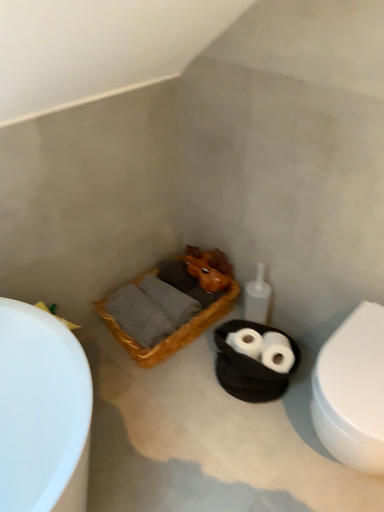
Question: Is white matte toilet paper at center wider than white glossy toilet at right?

Choices:
 (A) yes
 (B) no

Answer: (B)

Question: Is white matte toilet paper at center looking in the opposite direction of white glossy toilet at right?

Choices:
 (A) no
 (B) yes

Answer: (A)

Question: Is white matte toilet paper at center completely or partially outside of white glossy toilet at right?

Choices:
 (A) no
 (B) yes

Answer: (B)

Question: Is the depth of white matte toilet paper at center greater than that of white glossy toilet at right?

Choices:
 (A) yes
 (B) no

Answer: (A)

Question: Are white matte toilet paper at center and white glossy toilet at right located far from each other?

Choices:
 (A) no
 (B) yes

Answer: (A)

Question: Can you confirm if white matte toilet paper at center is thinner than white glossy toilet at right?

Choices:
 (A) yes
 (B) no

Answer: (A)

Question: Considering the relative positions of woven wood basket at center and white matte toilet paper at center in the image provided, is woven wood basket at center behind white matte toilet paper at center?

Choices:
 (A) no
 (B) yes

Answer: (B)

Question: Is woven wood basket at center positioned beyond the bounds of white matte toilet paper at center?

Choices:
 (A) yes
 (B) no

Answer: (A)

Question: Is woven wood basket at center aimed at white matte toilet paper at center?

Choices:
 (A) no
 (B) yes

Answer: (A)

Question: Is white matte toilet paper at center completely or partially inside woven wood basket at center?

Choices:
 (A) no
 (B) yes

Answer: (A)

Question: Is woven wood basket at center smaller than white matte toilet paper at center?

Choices:
 (A) no
 (B) yes

Answer: (A)

Question: Does woven wood basket at center have a larger size compared to white matte toilet paper at center?

Choices:
 (A) no
 (B) yes

Answer: (B)

Question: Does white glossy toilet at right have a greater height compared to black woven basket at center?

Choices:
 (A) no
 (B) yes

Answer: (B)